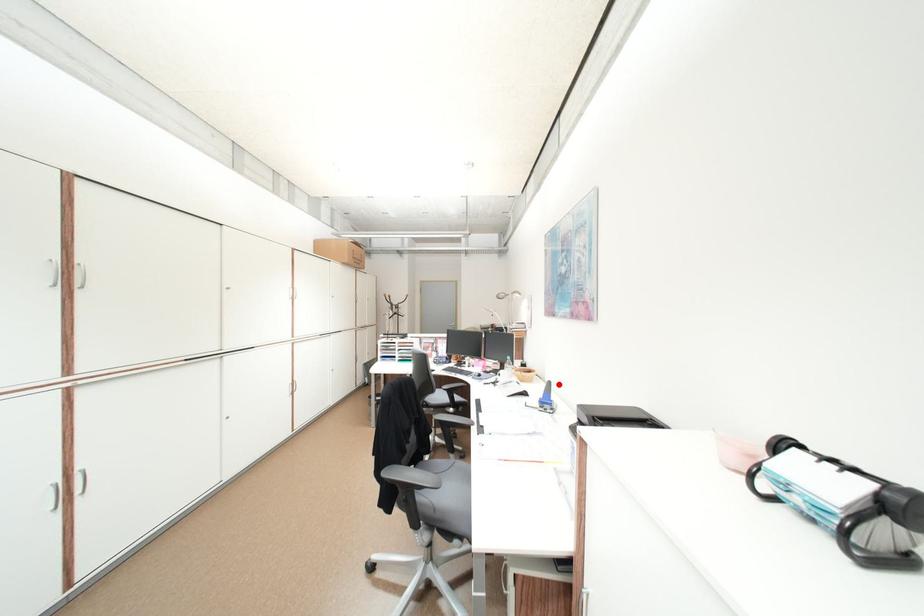
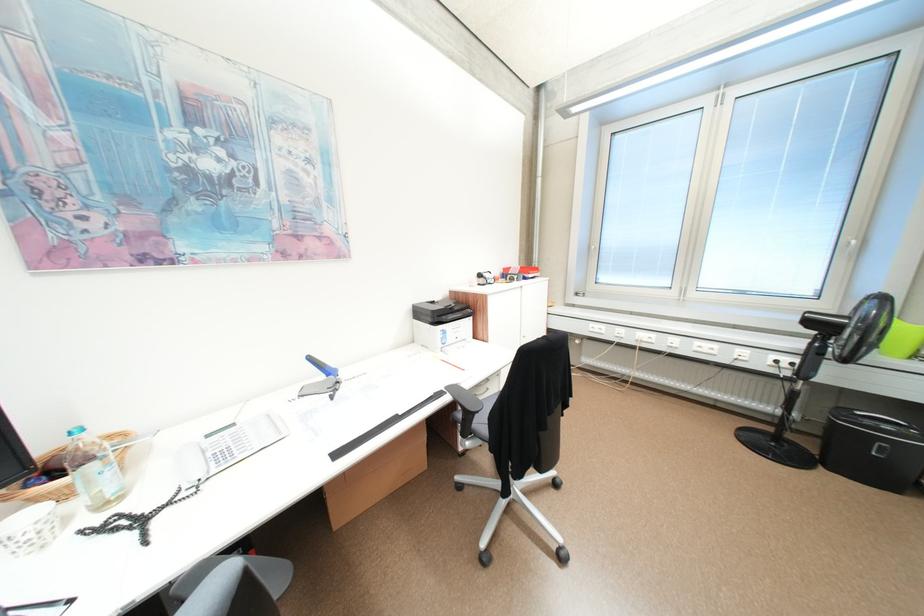
Where in the second image is the point corresponding to the highlighted location from the first image?

(320, 359)